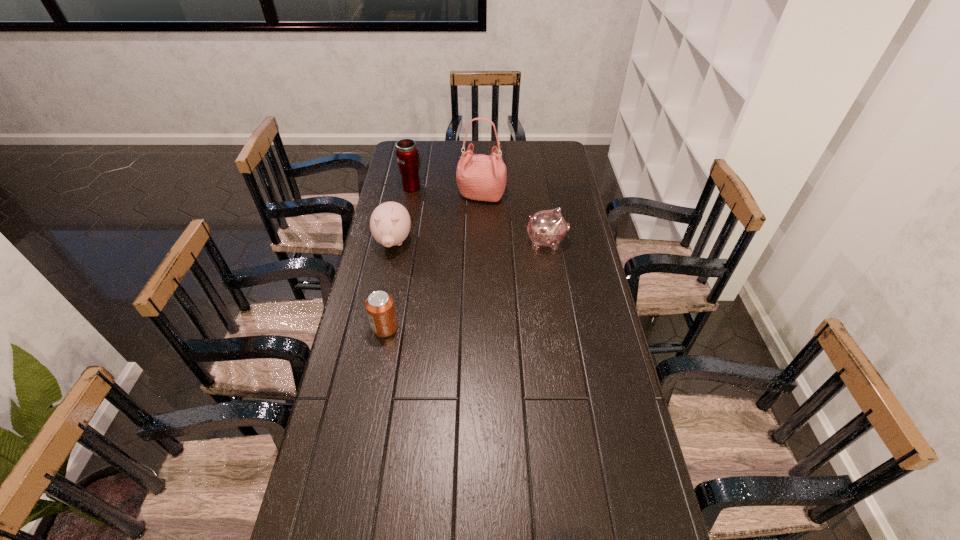
In order to click on free spot that satisfies the following two spatial constraints: 1. on the front facing side of the right piggy bank; 2. at the snout of the left piggy bank in this screenshot , I will do `click(546, 242)`.

This screenshot has width=960, height=540. I want to click on free space that satisfies the following two spatial constraints: 1. at the snout of the left piggy bank; 2. on the right side of the can, so click(375, 328).